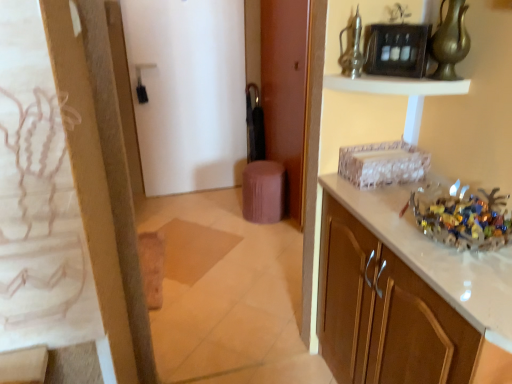
Locate an element on the screen. This screenshot has width=512, height=384. free space to the left of translucent glass bowl at right is located at coordinates (388, 223).